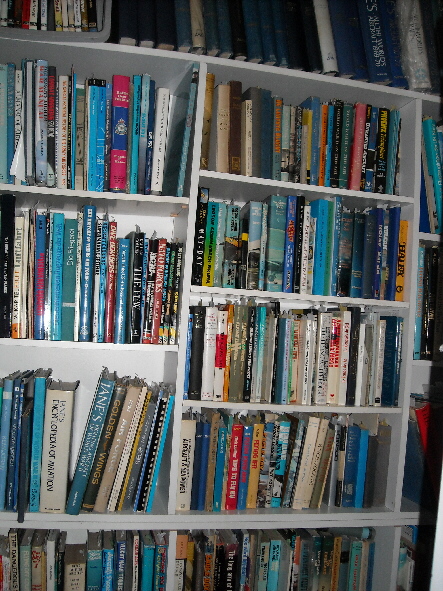
The height and width of the screenshot is (591, 443). Find the location of `top of books`. top of books is located at coordinates (110, 548), (126, 544), (95, 551), (75, 566), (60, 548), (54, 541), (37, 545).